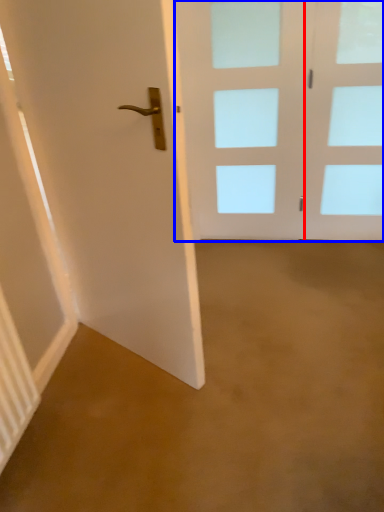
Question: Which object is further to the camera taking this photo, glass door (highlighted by a red box) or door (highlighted by a blue box)?

Choices:
 (A) glass door
 (B) door

Answer: (B)